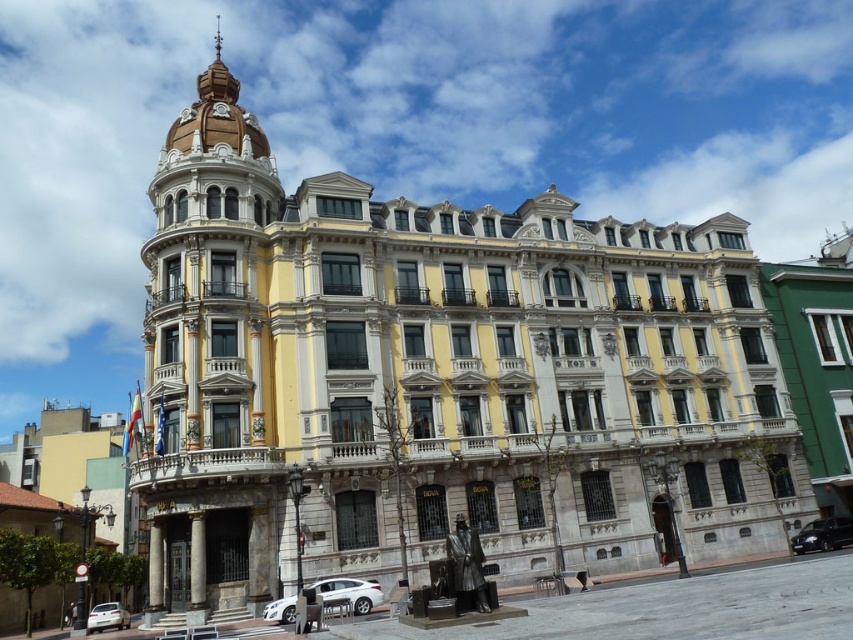
You are standing in front of the grand building and want to locate both the metallic silver van at lower right and the gold textured clock at upper center. Which object is positioned to the right side of the other?

The metallic silver van at lower right is to the right of gold textured clock at upper center.

You are standing in front of the grand building and notice two points marked on the ground. The first point is at coordinates point (223, 113) and the second is at point (187, 109). Which point is closer to the entrance of the building?

Point (223, 113) is in front of point (187, 109), so it is closer to the entrance of the building.